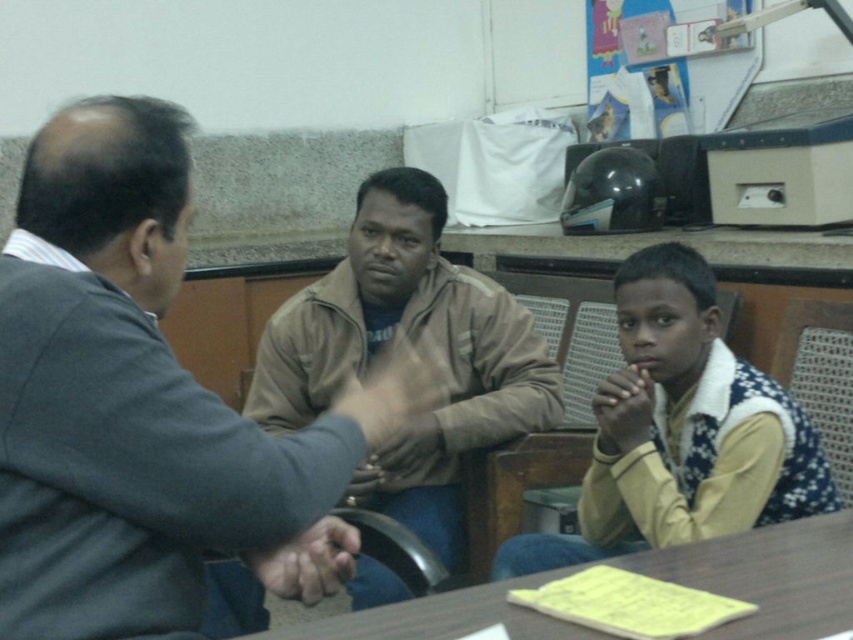
Question: Which of the following is the closest to the observer?

Choices:
 (A) brown leather jacket at center
 (B) yellow fleece vest at lower right
 (C) dark skin hand at center

Answer: (C)

Question: Can you confirm if dark gray suit at center is positioned to the right of brown wooden table at lower center?

Choices:
 (A) no
 (B) yes

Answer: (A)

Question: Which of the following is the farthest from the observer?

Choices:
 (A) (730, 522)
 (B) (57, 195)

Answer: (A)

Question: Which of these objects is positioned closest to the dark gray suit at center?

Choices:
 (A) dark skin hand at center
 (B) dark brown leather hands at center
 (C) brown wooden table at lower center
 (D) yellow fleece vest at lower right

Answer: (A)

Question: Does yellow fleece vest at lower right have a greater width compared to dark brown leather hands at center?

Choices:
 (A) no
 (B) yes

Answer: (B)

Question: Can you confirm if brown leather jacket at center is thinner than yellow fleece vest at lower right?

Choices:
 (A) yes
 (B) no

Answer: (B)